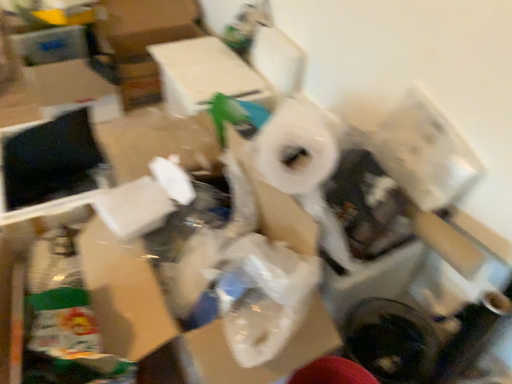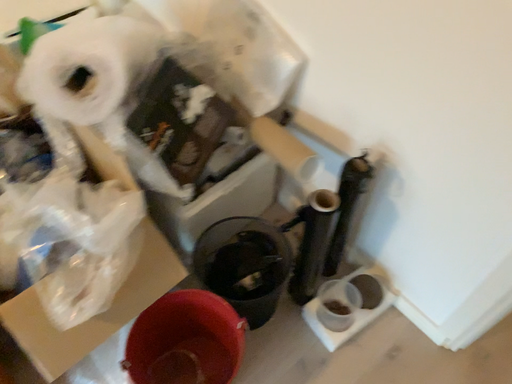
Question: How did the camera likely rotate when shooting the video?

Choices:
 (A) rotated downward
 (B) rotated upward

Answer: (A)